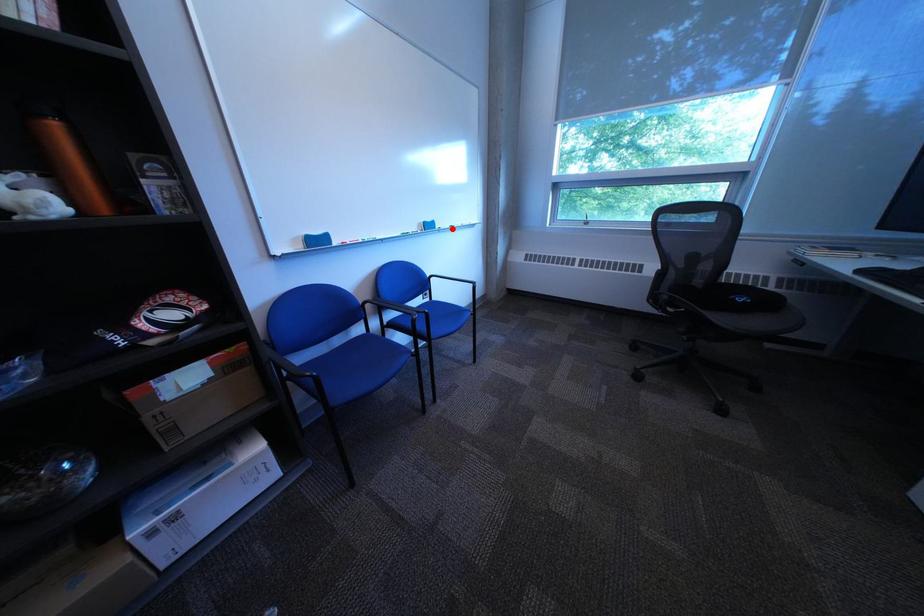
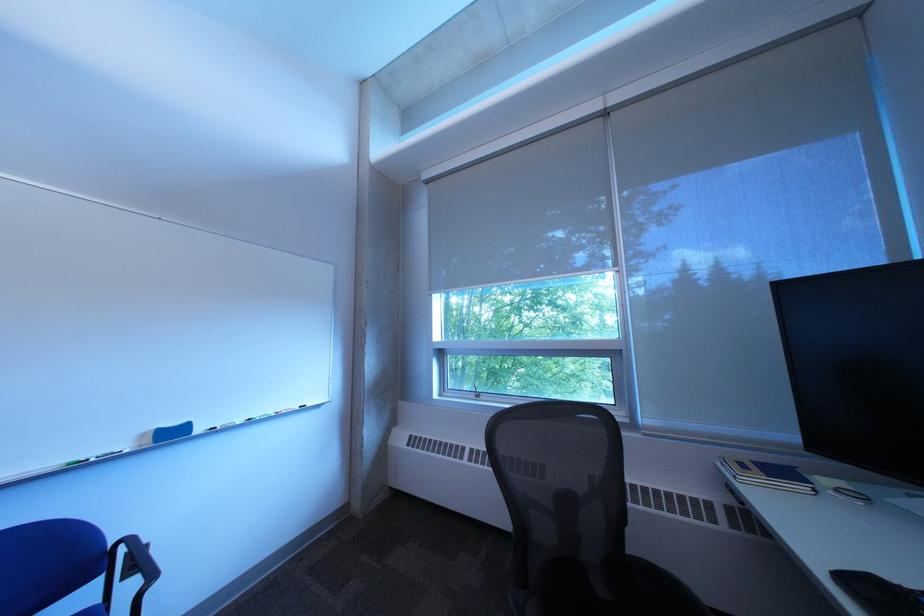
Where in the second image is the point corresponding to the highlighted location from the first image?

(213, 432)